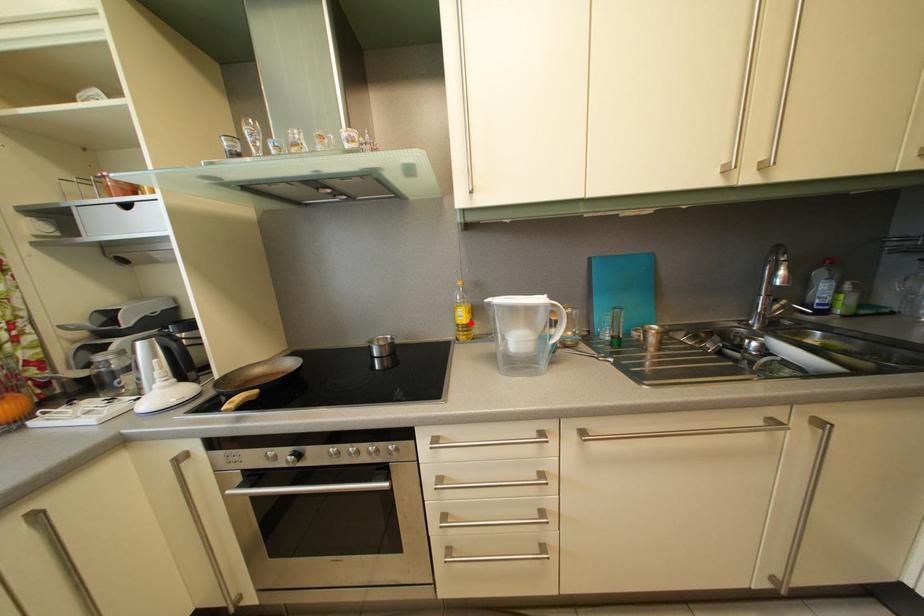
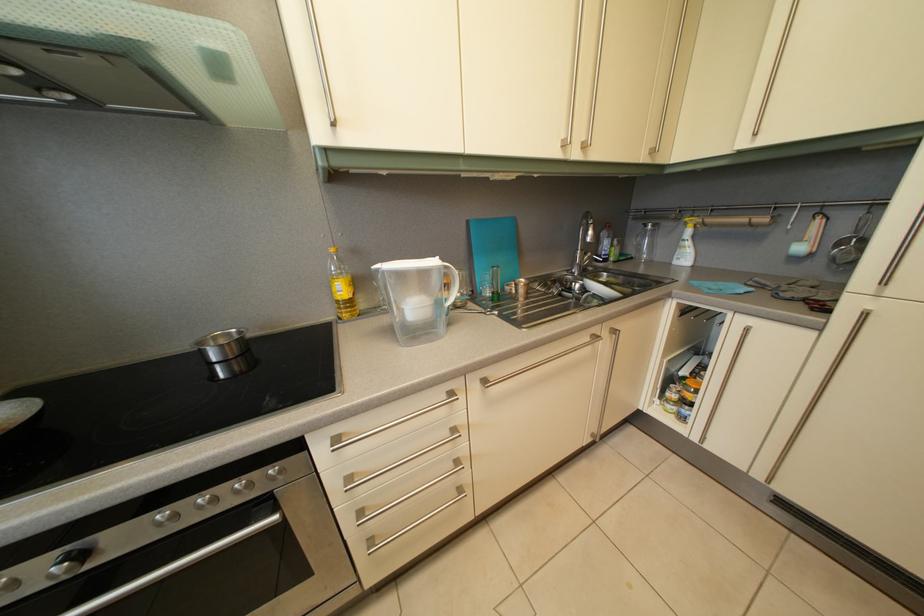
Find the pixel in the second image that matches the highlighted location in the first image.

(349, 297)